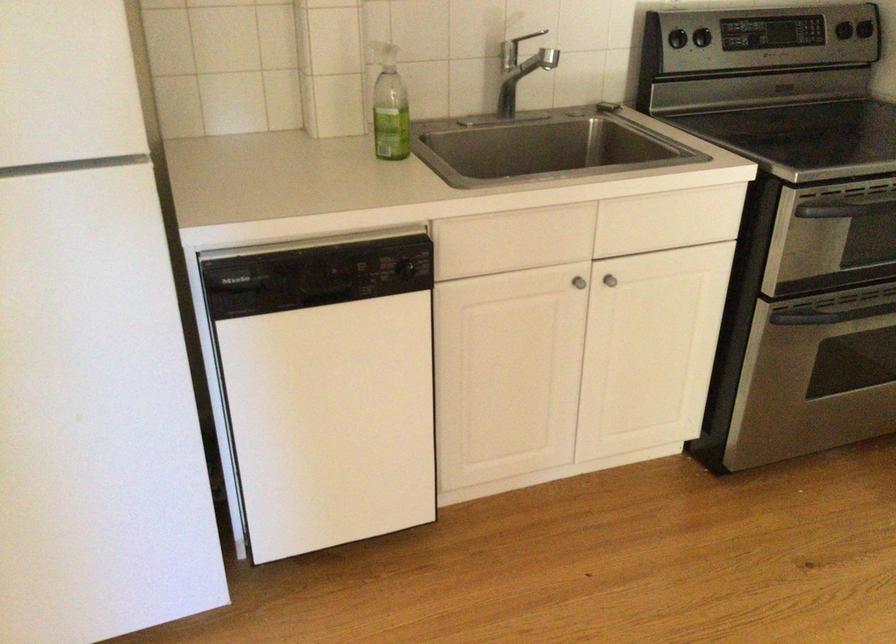
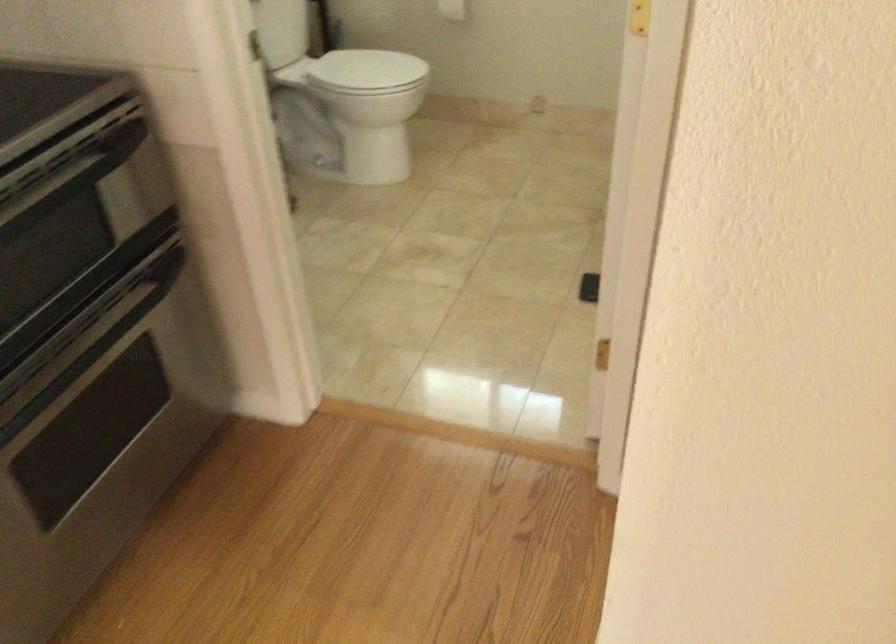
First-person continuous shooting, in which direction is the camera rotating?

The camera rotated toward right-down.